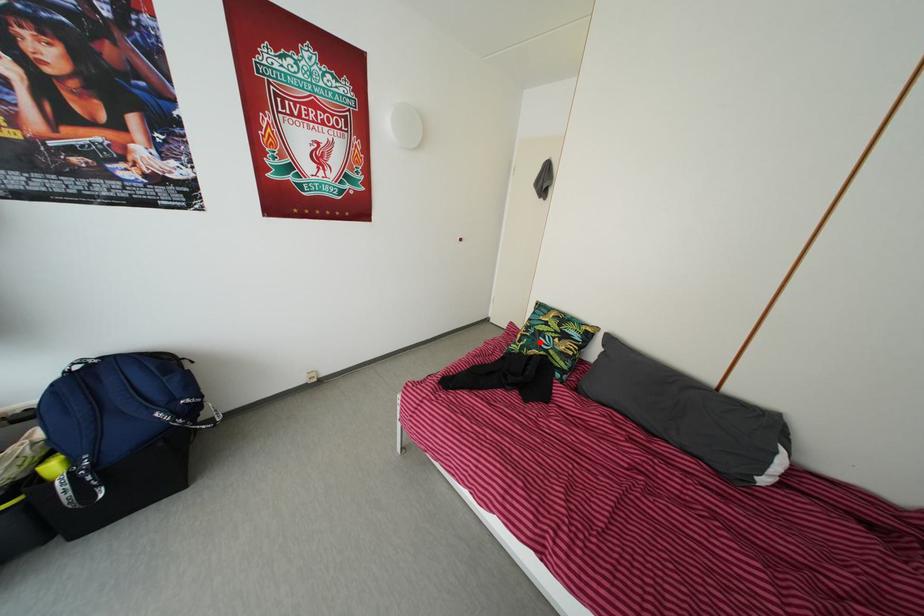
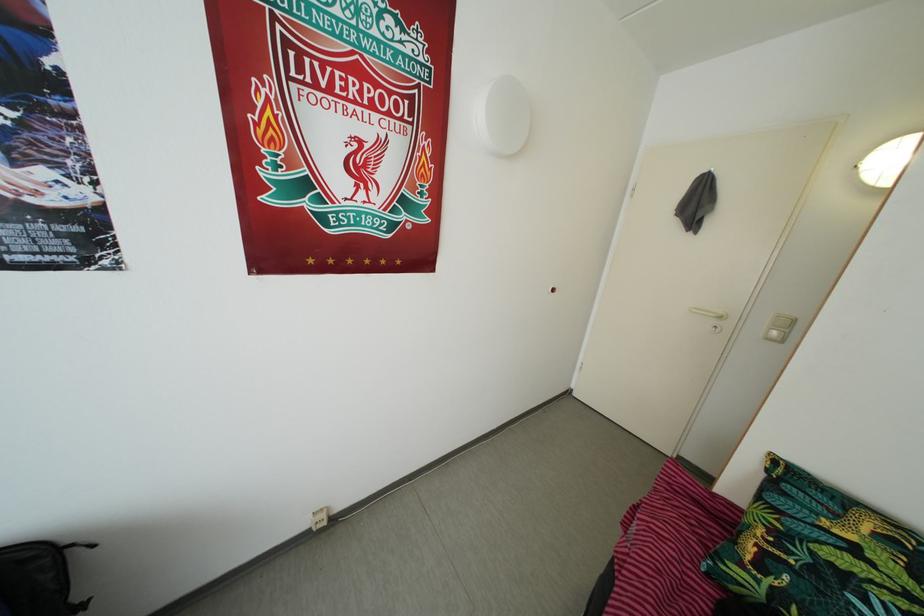
Question: I am providing you with two images of the same scene from different viewpoints. Given a red point in image1, look at the same physical point in image2. Is it:

Choices:
 (A) Closer to the viewpoint
 (B) Farther from the viewpoint

Answer: (A)